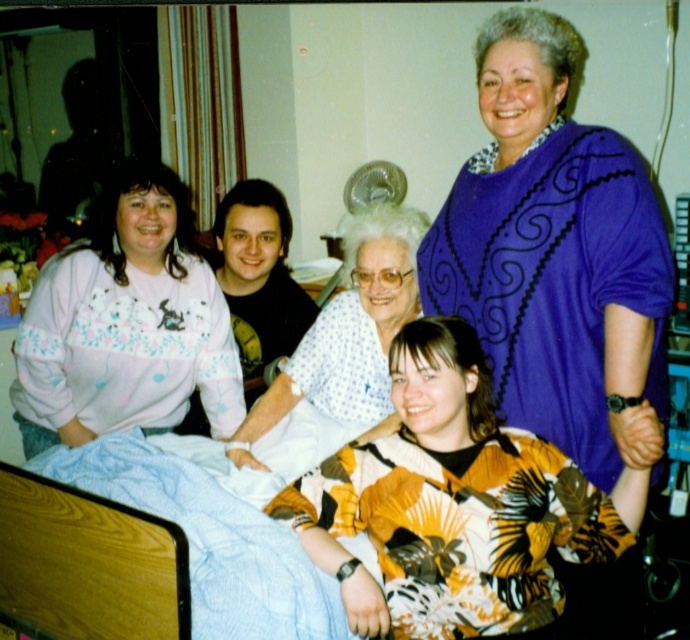
Question: Is matte pink sweater at left to the left of white dotted fabric at center from the viewer's perspective?

Choices:
 (A) no
 (B) yes

Answer: (B)

Question: Is purple swirled sweater at upper right below yellow floral shirt at center?

Choices:
 (A) yes
 (B) no

Answer: (B)

Question: Among these objects, which one is nearest to the camera?

Choices:
 (A) matte pink sweater at left
 (B) purple swirled sweater at upper right

Answer: (B)

Question: Which point is farther to the camera?

Choices:
 (A) white dotted fabric at center
 (B) purple swirled sweater at upper right

Answer: (A)

Question: Does purple swirled sweater at upper right lie in front of matte pink sweater at left?

Choices:
 (A) no
 (B) yes

Answer: (B)

Question: Which point appears farthest from the camera in this image?

Choices:
 (A) (268, 422)
 (B) (135, 371)
 (C) (642, 256)
 (D) (402, 627)

Answer: (B)